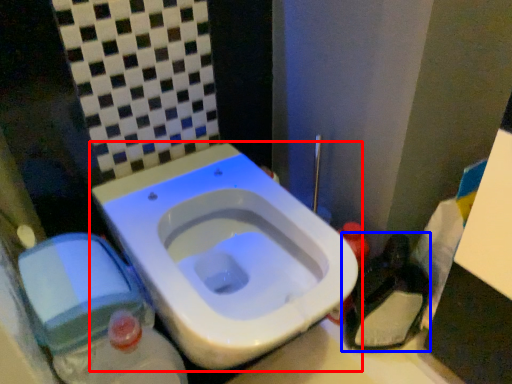
Question: Among these objects, which one is nearest to the camera, toilet (highlighted by a red box) or garbage (highlighted by a blue box)?

Choices:
 (A) toilet
 (B) garbage

Answer: (A)